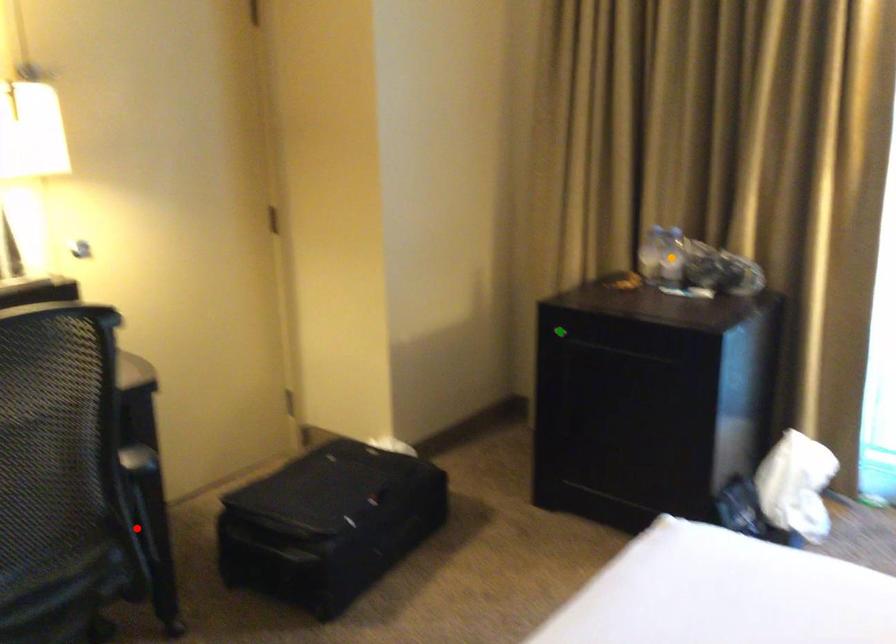
Order these from nearest to farthest:
orange point
red point
green point

orange point < green point < red point